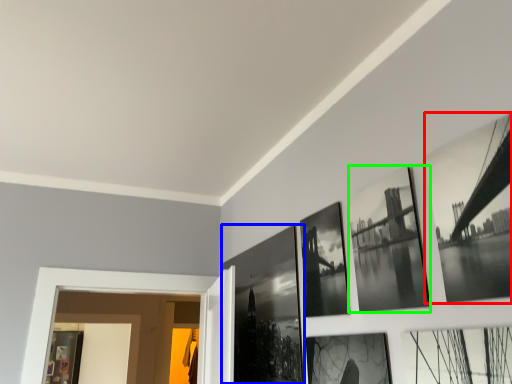
Question: Considering the real-world distances, which object is closest to picture frame (highlighted by a red box)? picture frame (highlighted by a blue box) or picture frame (highlighted by a green box).

Choices:
 (A) picture frame
 (B) picture frame

Answer: (B)